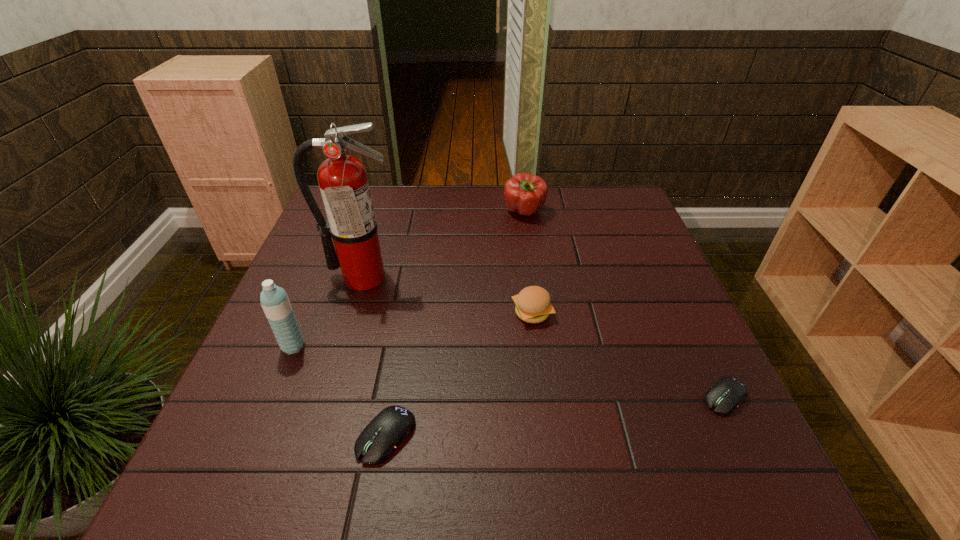
The image size is (960, 540). What are the coordinates of `fire extinguisher positioned at the left edge` in the screenshot? It's located at (343, 182).

Where is `object that is at the right edge`? The width and height of the screenshot is (960, 540). object that is at the right edge is located at coordinates (725, 396).

Find the location of a particular element. The height and width of the screenshot is (540, 960). object that is at the near right corner is located at coordinates (725, 396).

Locate an element on the screen. free space at the far edge of the desktop is located at coordinates (462, 202).

In the image, there is a desktop. In order to click on vacant space at the near edge in this screenshot , I will do `click(321, 401)`.

You are a GUI agent. You are given a task and a screenshot of the screen. Output one action in this format:
    pyautogui.click(x=<x>, y=<y>)
    Task: Click on the vacant region at the left edge
    Image resolution: width=960 pixels, height=540 pixels.
    Given the screenshot: What is the action you would take?
    pyautogui.click(x=243, y=386)

Where is `free space at the right edge`? free space at the right edge is located at coordinates (607, 259).

The image size is (960, 540). I want to click on free region at the far right corner of the desktop, so click(x=622, y=221).

Where is `free space at the near right corner of the desktop`? The image size is (960, 540). free space at the near right corner of the desktop is located at coordinates (660, 422).

Where is `free spot between the second tallest object and the third farthest object`? The height and width of the screenshot is (540, 960). free spot between the second tallest object and the third farthest object is located at coordinates tap(413, 329).